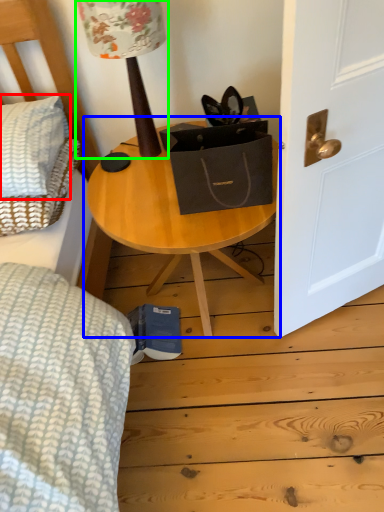
Question: Based on their relative distances, which object is farther from pillow (highlighted by a red box)? Choose from table (highlighted by a blue box) and table lamp (highlighted by a green box).

Choices:
 (A) table
 (B) table lamp

Answer: (B)